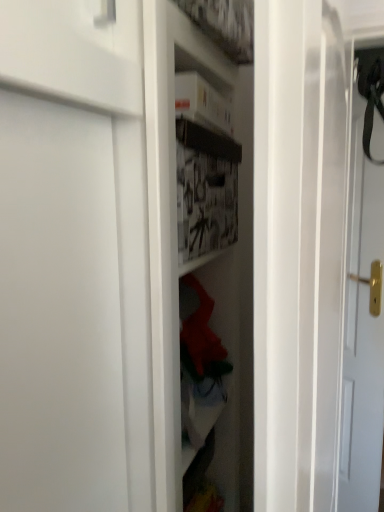
Question: Should I look upward or downward to see matte white door at right?

Choices:
 (A) down
 (B) up

Answer: (A)